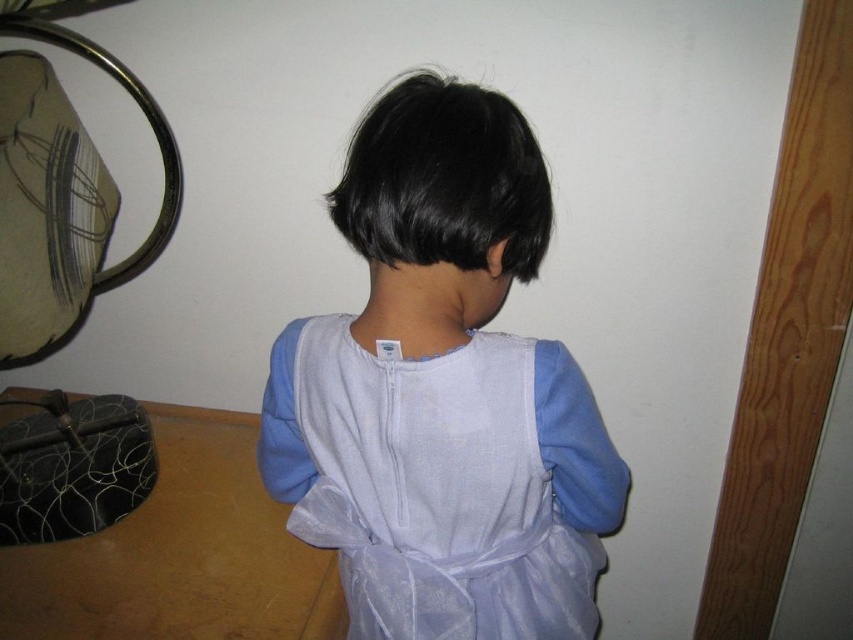
You are a tailor measuring the light blue sheer fabric apron at back for adjustments. The mirror to the left reflects part of the room. Can you see the apron in the mirror?

The light blue sheer fabric apron at back is located at point (448, 484), which is on the child wearing it. Since the mirror reflects part of the room including the area where the child is standing, it is possible that the apron is visible in the mirror depending on the angle and positioning of both the mirror and the child.

You are a tailor measuring a child for a new dress. You notice the light blue fabric dress at center and the black silky hair at center. Which one is wider?

The light blue fabric dress at center is wider than the black silky hair at center.